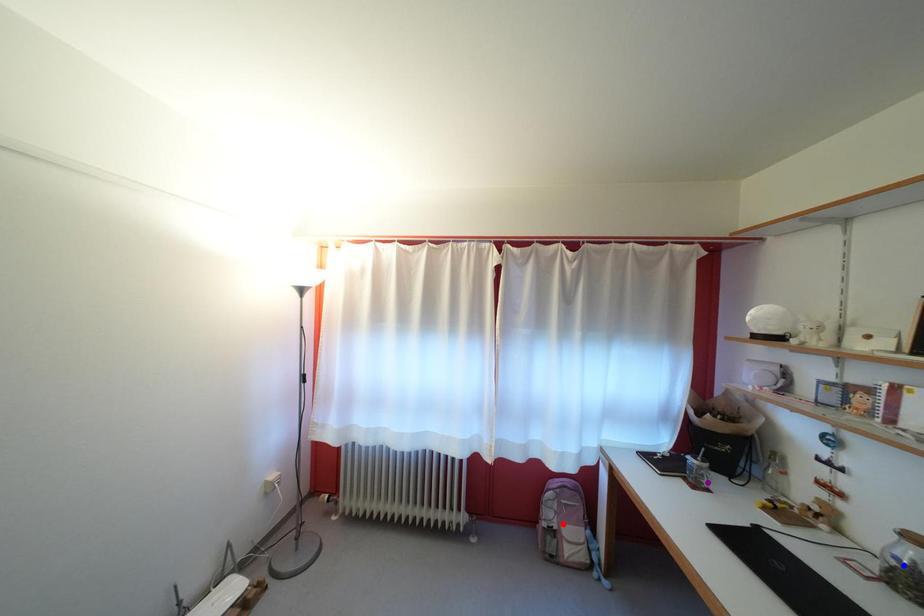
Order these from nearest to farthest:
A) red point
B) blue point
C) purple point

red point, purple point, blue point